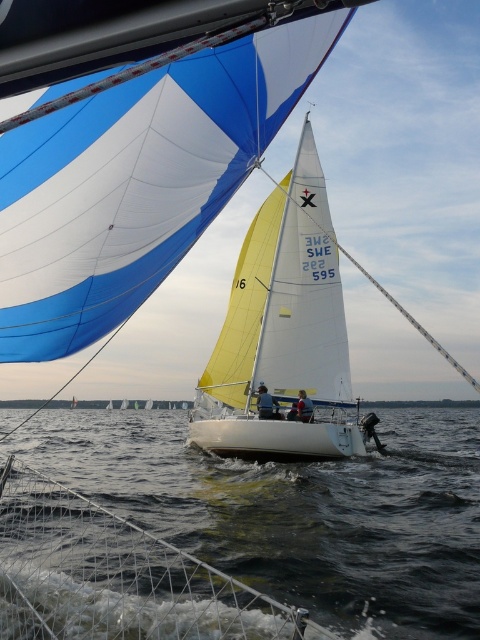
You are a sailor trying to navigate between the dark blue water at lower center and the white matte sailboat at center. Which direction should you steer to reach the water?

The dark blue water at lower center is located below the white matte sailboat at center, so you should steer downward towards the dark blue water at lower center to reach it.

What is the 2D coordinate of the dark blue water at lower center in the image?

The dark blue water at lower center is located at the 2D coordinate point of (x=297, y=512).